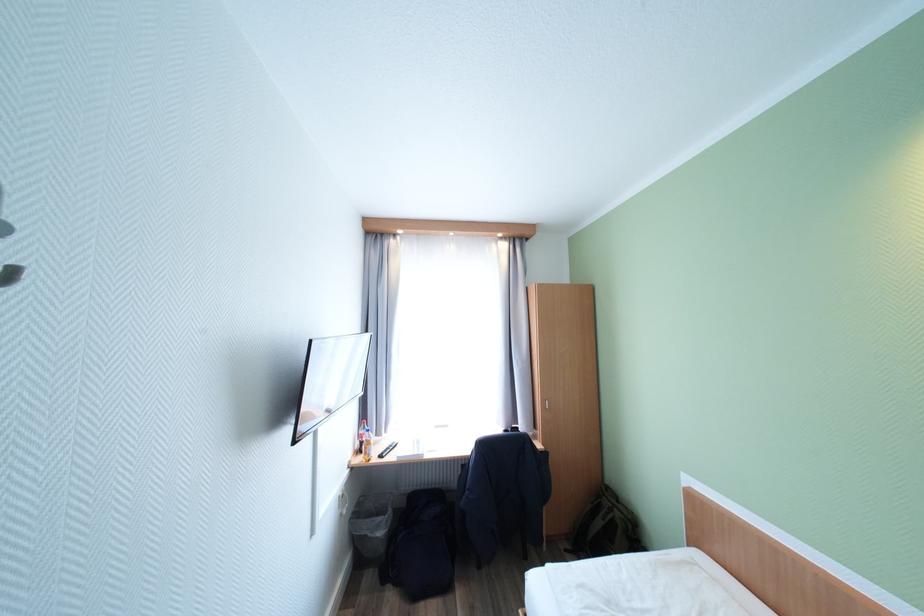
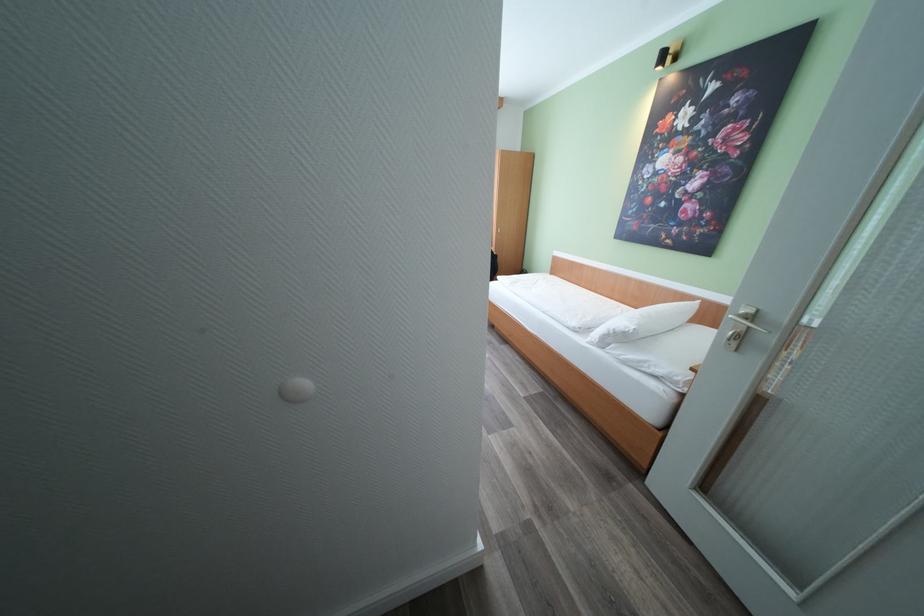
Question: I am providing you with two images of the same scene from different viewpoints. After the viewpoint changes to image2, which objects are now occluded?

Choices:
 (A) green backpack
 (B) silver door handle
 (C) steel trash can lid
 (D) white pillow

Answer: (A)